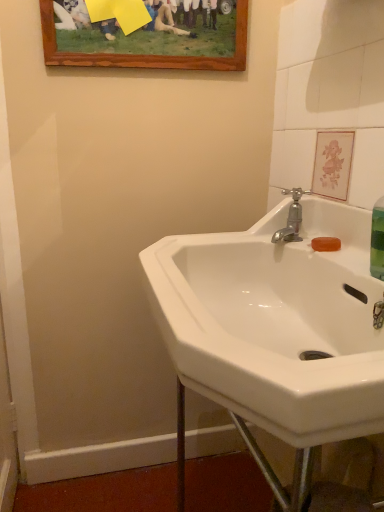
Question: Considering the positions of point (291, 218) and point (281, 298), is point (291, 218) closer or farther from the camera than point (281, 298)?

Choices:
 (A) farther
 (B) closer

Answer: (A)

Question: Is silver metallic faucet at upper right in front of or behind white glossy sink at center in the image?

Choices:
 (A) front
 (B) behind

Answer: (B)

Question: Which object is positioned farthest from the silver metallic faucet at upper right?

Choices:
 (A) white glossy sink at center
 (B) wooden picture frame at upper center

Answer: (B)

Question: Which is farther from the wooden picture frame at upper center?

Choices:
 (A) white glossy sink at center
 (B) silver metallic faucet at upper right

Answer: (A)